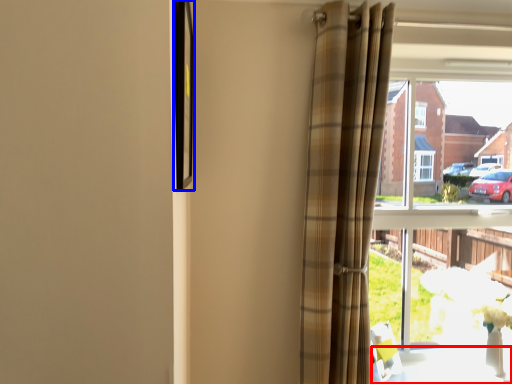
Question: Among these objects, which one is farthest to the camera, table (highlighted by a red box) or picture frame (highlighted by a blue box)?

Choices:
 (A) table
 (B) picture frame

Answer: (A)